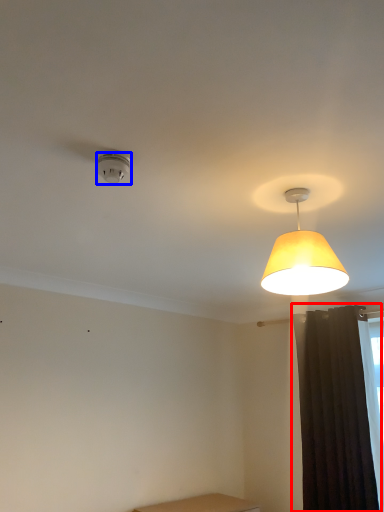
Question: Among these objects, which one is farthest to the camera, curtain (highlighted by a red box) or lamp (highlighted by a blue box)?

Choices:
 (A) curtain
 (B) lamp

Answer: (A)